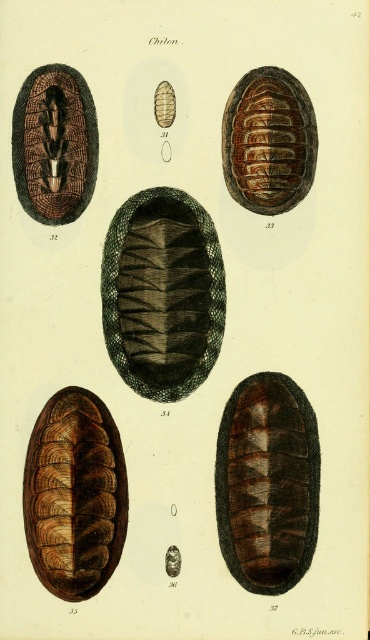
From the picture: You are a marine biologist examining the botanical illustration of chitons. You notice two specimens labeled as the brown textured snail at lower left and the brown textured pill at upper center. Which of these two specimens has a greater height in the illustration?

The brown textured snail at lower left is taller than the brown textured pill at upper center according to the illustration.